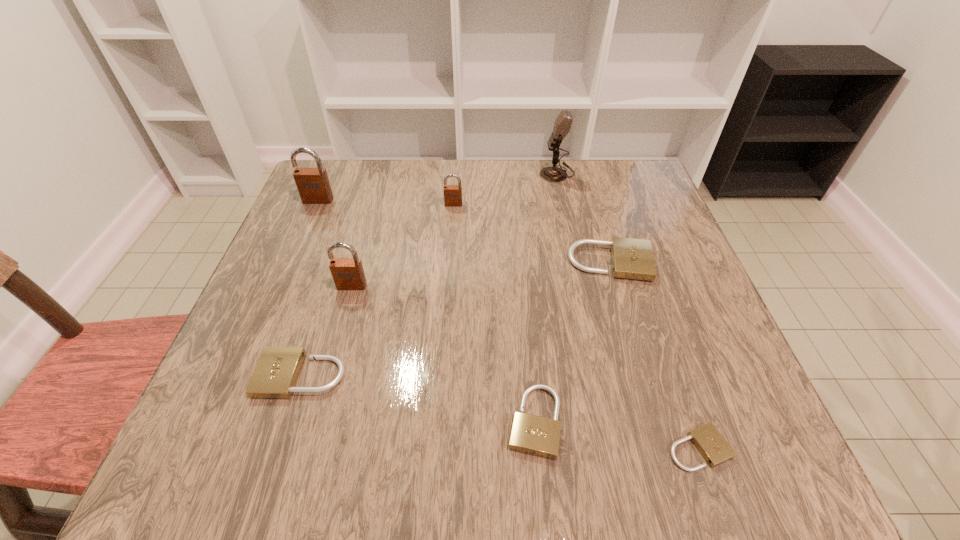
Identify the location of vacant space positioned 0.180m on the front-facing side of the second brown padlock from left to right. (330, 364).

At what (x,y) coordinates should I click in order to perform the action: click on vacant space positioned on the front-facing side of the smallest brown padlock. Please return your answer as a coordinate pair (x, y). Looking at the image, I should click on (448, 285).

Find the location of a particular element. The width and height of the screenshot is (960, 540). vacant region located 0.320m on the back of the farthest beige padlock is located at coordinates (x=583, y=168).

At what (x,y) coordinates should I click in order to perform the action: click on vacant area situated 0.160m on the back of the fifth tallest padlock. Please return your answer as a coordinate pair (x, y). Image resolution: width=960 pixels, height=540 pixels. Looking at the image, I should click on point(330,288).

This screenshot has height=540, width=960. What are the coordinates of `blank space located on the back of the third beige padlock from right to left` in the screenshot? It's located at tap(523, 303).

The image size is (960, 540). In order to click on free space located on the back of the shortest padlock in this screenshot , I will do `click(660, 340)`.

Image resolution: width=960 pixels, height=540 pixels. Identify the location of microphone situated at the far edge. (562, 125).

Image resolution: width=960 pixels, height=540 pixels. Find the location of `object that is at the far left corner`. object that is at the far left corner is located at coordinates (313, 185).

Locate an element on the screen. object that is at the near right corner is located at coordinates (708, 440).

Find the location of a particular element. The width and height of the screenshot is (960, 540). free space at the far edge of the desktop is located at coordinates (532, 170).